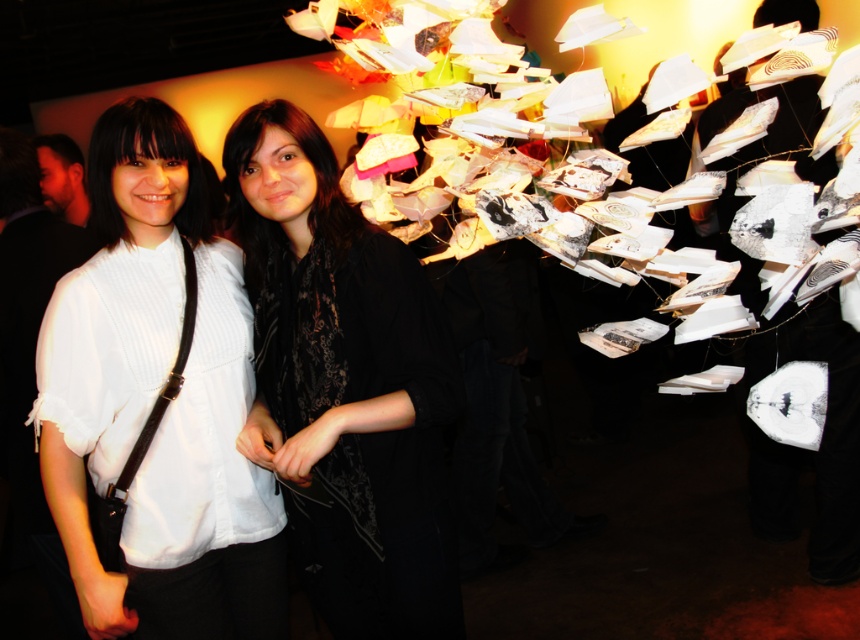
Question: Among these objects, which one is nearest to the camera?

Choices:
 (A) black lace scarf at center
 (B) white matte shirt at center

Answer: (A)

Question: Is white matte shirt at center to the left of black lace scarf at center from the viewer's perspective?

Choices:
 (A) yes
 (B) no

Answer: (A)

Question: Which point is farther to the camera?

Choices:
 (A) (62, 392)
 (B) (255, 200)

Answer: (B)

Question: Is the position of white matte shirt at center less distant than that of black lace scarf at center?

Choices:
 (A) yes
 (B) no

Answer: (B)

Question: Is white matte shirt at center bigger than black lace scarf at center?

Choices:
 (A) yes
 (B) no

Answer: (B)

Question: Which of the following is the closest to the observer?

Choices:
 (A) black lace scarf at center
 (B) white matte shirt at center

Answer: (A)